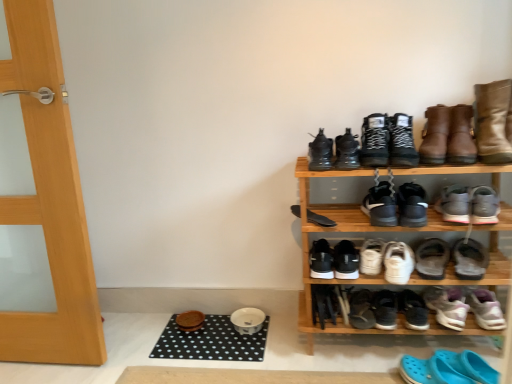
Locate an element on the screen. The height and width of the screenshot is (384, 512). vacant area to the right of black dotted mat at lower center, the first doormat in the back-to-front sequence is located at coordinates (291, 342).